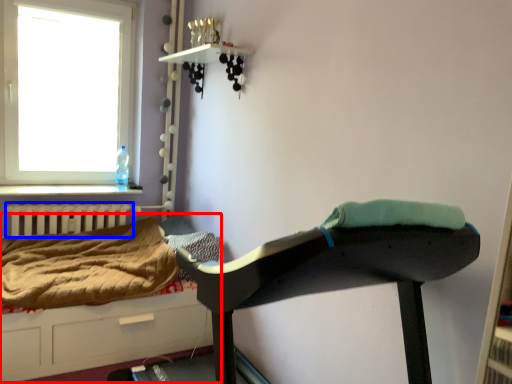
Question: Which object is further to the camera taking this photo, hospital bed (highlighted by a red box) or radiator (highlighted by a blue box)?

Choices:
 (A) hospital bed
 (B) radiator

Answer: (B)